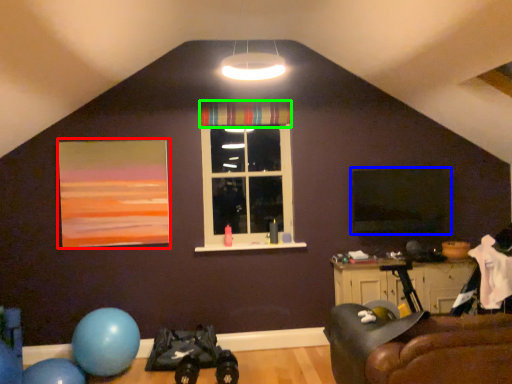
Question: Which object is positioned closest to picture frame (highlighted by a red box)? Select from window screen (highlighted by a blue box) and curtain (highlighted by a green box).

Choices:
 (A) window screen
 (B) curtain

Answer: (B)